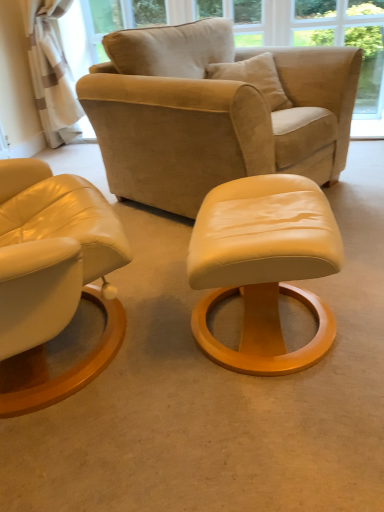
At what (x,y) coordinates should I click in order to perform the action: click on free space in front of matte cream leather ottoman at center. Please return your answer as a coordinate pair (x, y). The width and height of the screenshot is (384, 512). Looking at the image, I should click on (266, 434).